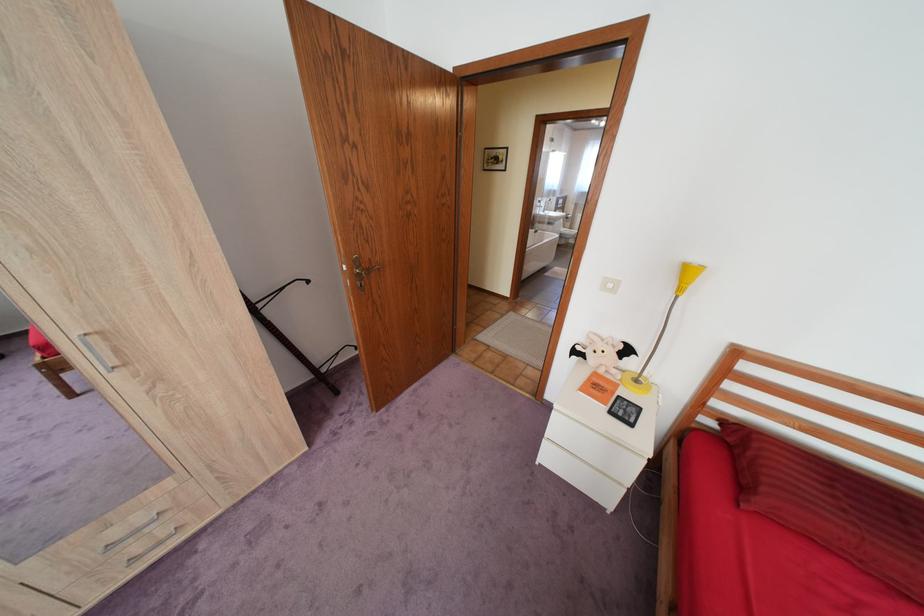
The height and width of the screenshot is (616, 924). I want to click on red striped pillow, so click(824, 499).